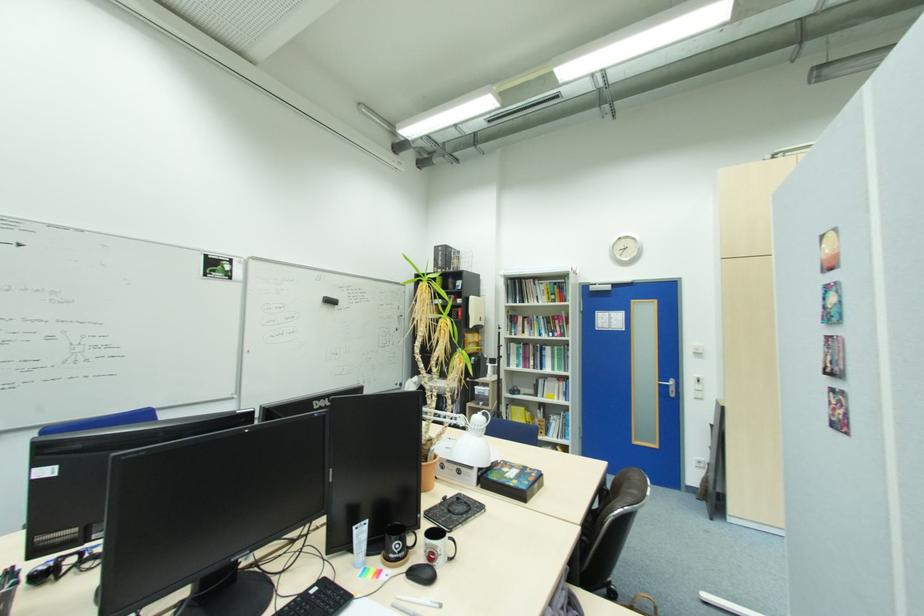
Identify the location of white coffee mug. The height and width of the screenshot is (616, 924). (438, 546).